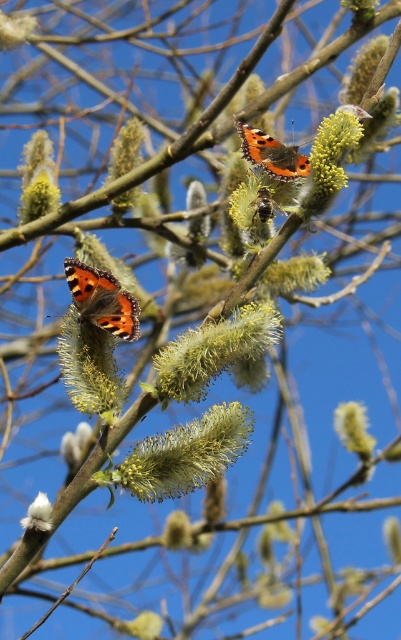
You are an entomologist observing the butterflies on the yellow fuzzy flower at center and the fuzzy yellow flower at left. Which flower do you think the butterfly is perched on that is bigger in size?

The yellow fuzzy flower at center is larger in size compared to the fuzzy yellow flower at left, so the butterfly on the yellow fuzzy flower at center is perched on the bigger one.

You are a photographer trying to capture both the fuzzy yellow flower at left and the yellow fuzzy catkin at center in a single shot. Given that your camera can focus on objects within a 30 inch range, will you be able to capture both in focus without adjusting your camera settings?

The fuzzy yellow flower at left is 36.32 inches away from the yellow fuzzy catkin at center. Since the distance between them exceeds the camera focus range of 30 inches, you will need to adjust your camera settings to ensure both are in focus.

You are an entomologist observing two Small Tortoiseshell butterflies in a willow tree. You notice one butterfly is at point (212, 352). Where exactly is this butterfly located in relation to the yellow fuzzy flower at center?

The point (212, 352) is on the yellow fuzzy flower at center, so the butterfly is located on the yellow fuzzy flower at center.